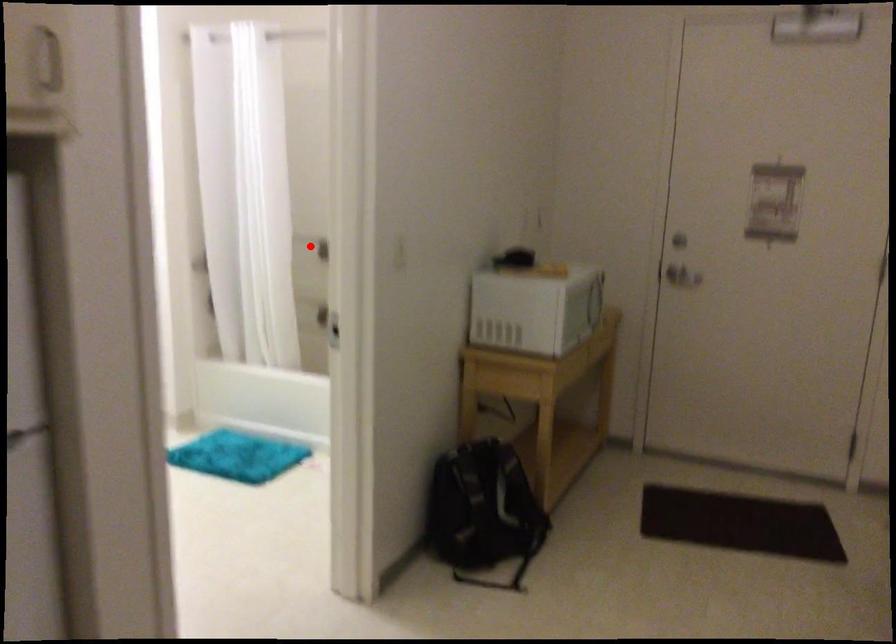
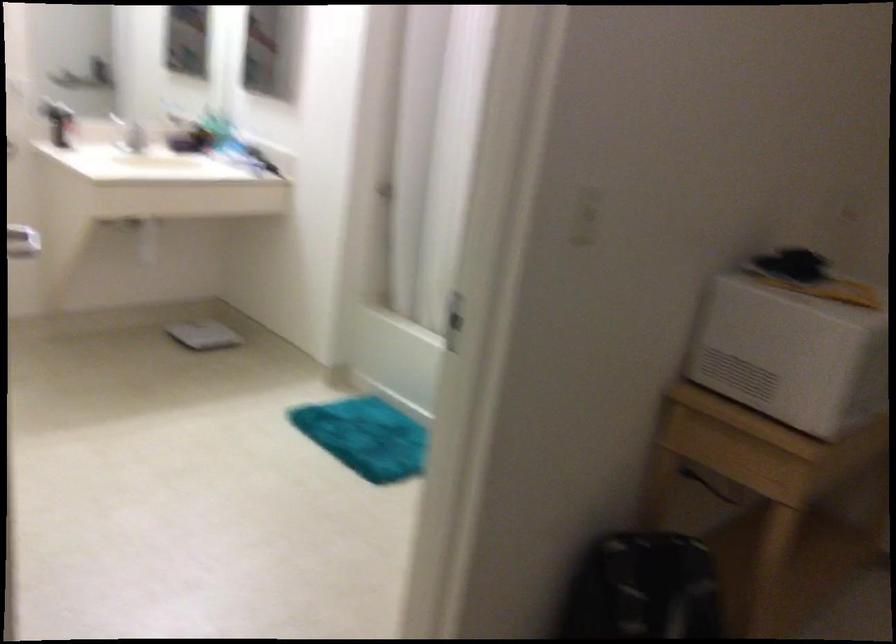
Question: I am providing you with two images of the same scene from different viewpoints. A red point is marked on the first image. Is the red point's position out of view in image 2?

Choices:
 (A) Yes
 (B) No

Answer: (A)